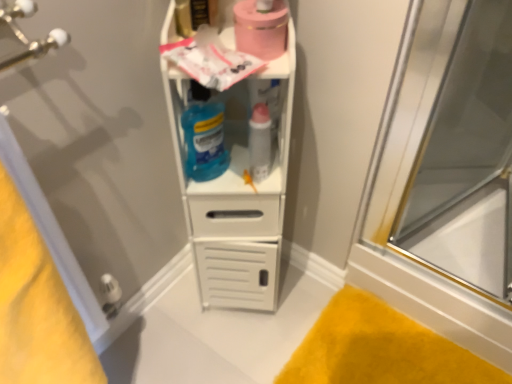
Locate an element on the screen. free point in front of white plastic shelf at center is located at coordinates (233, 344).